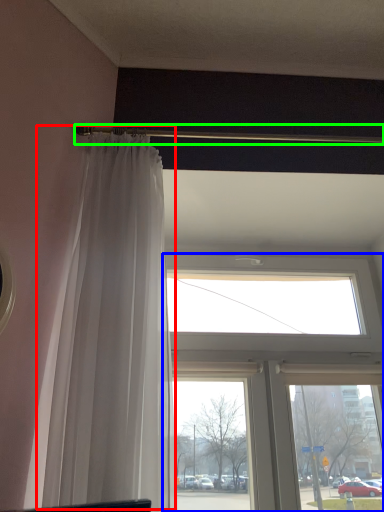
Question: Estimate the real-world distances between objects in this image. Which object is closer to curtain (highlighted by a red box), window (highlighted by a blue box) or beam (highlighted by a green box)?

Choices:
 (A) window
 (B) beam

Answer: (B)